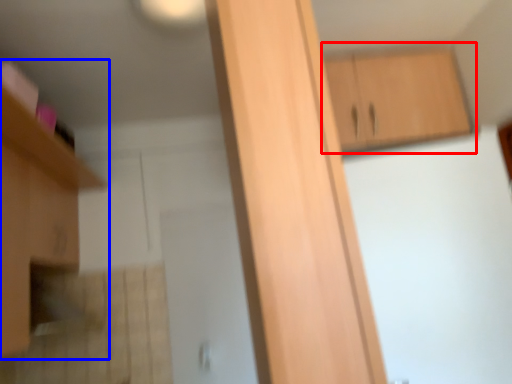
Question: Among these objects, which one is farthest to the camera, cabinetry (highlighted by a red box) or cabinetry (highlighted by a blue box)?

Choices:
 (A) cabinetry
 (B) cabinetry

Answer: (A)